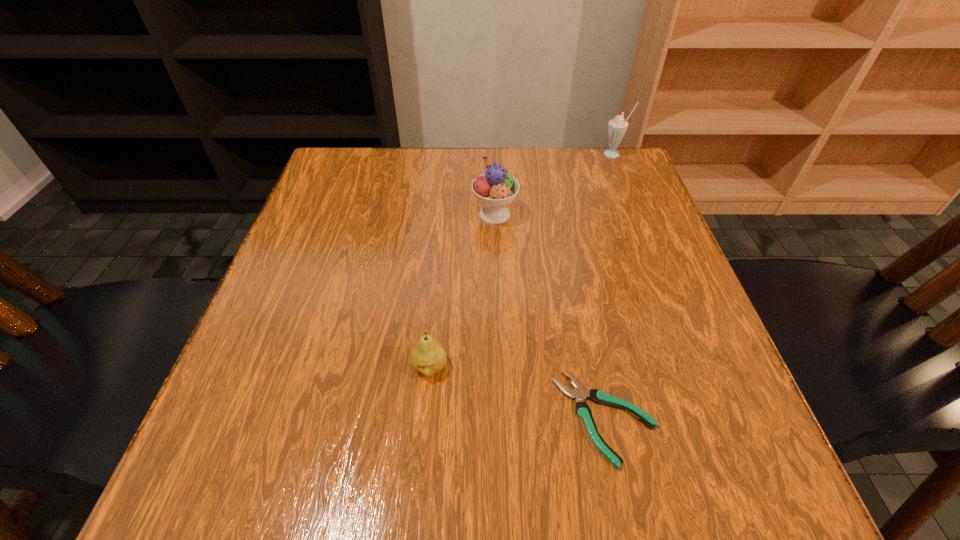
Find the location of `free point between the rightmost object and the shortest object`. free point between the rightmost object and the shortest object is located at coordinates (611, 286).

Where is `free spot between the rightmost object and the pear`? This screenshot has height=540, width=960. free spot between the rightmost object and the pear is located at coordinates (522, 261).

You are a GUI agent. You are given a task and a screenshot of the screen. Output one action in this format:
    pyautogui.click(x=<x>, y=<y>)
    Task: Click on the empty space that is in between the farthest object and the pear
    This screenshot has width=960, height=540.
    Given the screenshot: What is the action you would take?
    pyautogui.click(x=522, y=261)

Find the location of `free space between the leftmost object and the farthest object`. free space between the leftmost object and the farthest object is located at coordinates (522, 261).

In order to click on object identified as the third closest to the rightmost object in this screenshot , I will do `click(428, 357)`.

This screenshot has width=960, height=540. I want to click on object identified as the closest to the farthest object, so click(x=496, y=189).